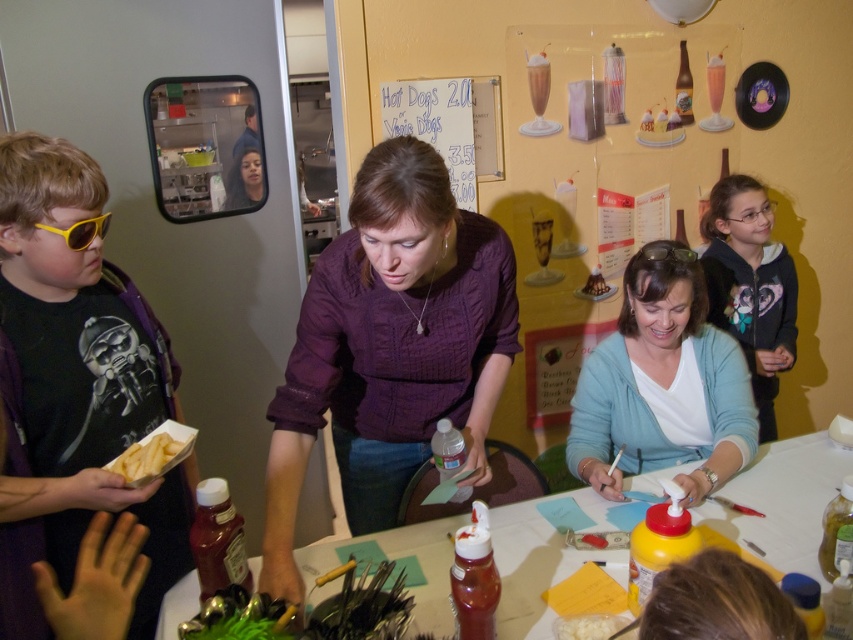
Question: Is matte black shirt at left further to the viewer compared to smooth white table at center?

Choices:
 (A) no
 (B) yes

Answer: (A)

Question: Which of these objects is positioned farthest from the purple knit sweater at center?

Choices:
 (A) black plastic goggles at center
 (B) white matte shirt at center
 (C) white paperboard at upper center
 (D) yellow matte french fries at lower left

Answer: (C)

Question: Can you confirm if yellow matte french fries at lower left is smaller than chocolate cake at center?

Choices:
 (A) yes
 (B) no

Answer: (B)

Question: Is the position of white matte shirt at center more distant than that of smooth white table at center?

Choices:
 (A) no
 (B) yes

Answer: (B)

Question: Among these objects, which one is nearest to the camera?

Choices:
 (A) white crumbly food at lower center
 (B) chocolate cake at center
 (C) white paperboard at upper center
 (D) matte black shirt at left

Answer: (D)

Question: Which point appears closest to the camera in this image?

Choices:
 (A) (142, 464)
 (B) (616, 353)
 (C) (569, 561)

Answer: (A)